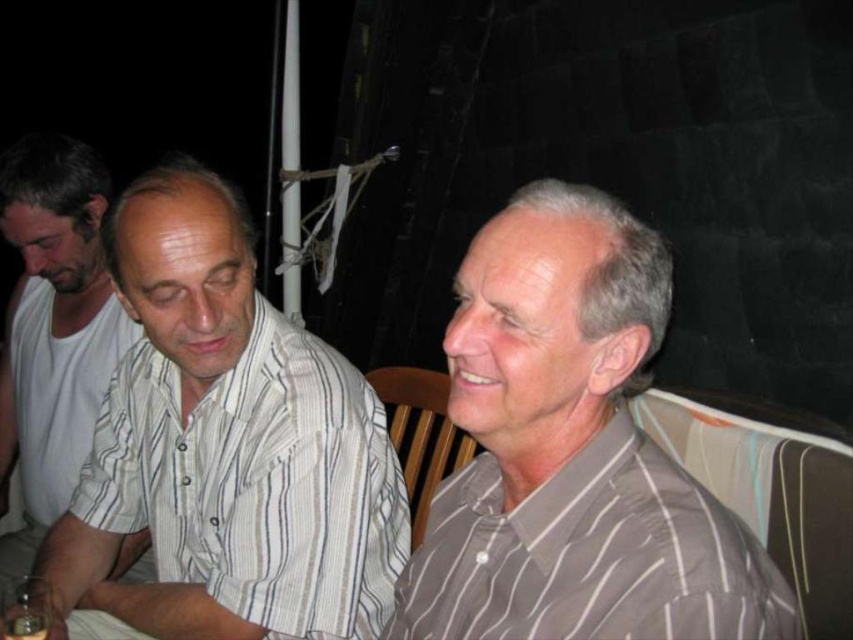
You are standing in the dimly lit area and see the three people. The gray striped shirt at right is located at point (573, 452). Can you tell me the coordinates of the gray striped shirt at right?

The gray striped shirt at right is located at point (573, 452).

You are trying to locate two people in a dark setting. You see a white striped shirt at center and a gray striped shirt at right. Which one is positioned more to the left?

The white striped shirt at center is positioned more to the left than the gray striped shirt at right.

You are organizing a clothing donation drive and need to categorize shirts by size. You have two shirts to sort out. The first is the white striped shirt at center, and the second is the white striped shirt at left. Which shirt should be placed in the small size bin?

The white striped shirt at center has a smaller size compared to the white striped shirt at left, so it should be placed in the small size bin.